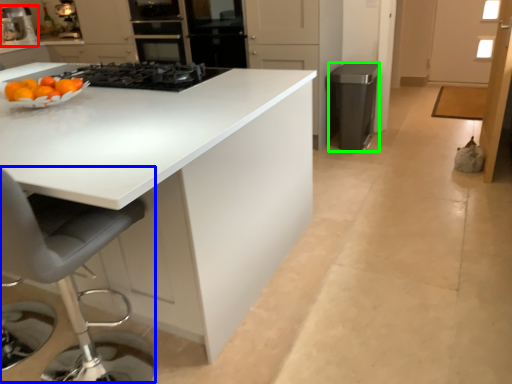
Question: Considering the real-world distances, which object is farthest from home appliance (highlighted by a red box)? swivel chair (highlighted by a blue box) or appliance (highlighted by a green box)?

Choices:
 (A) swivel chair
 (B) appliance

Answer: (A)